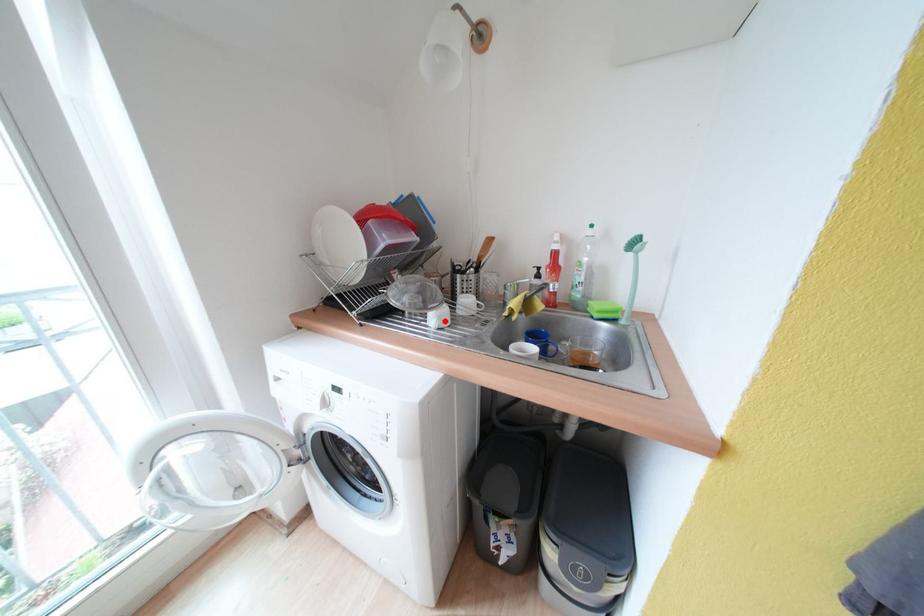
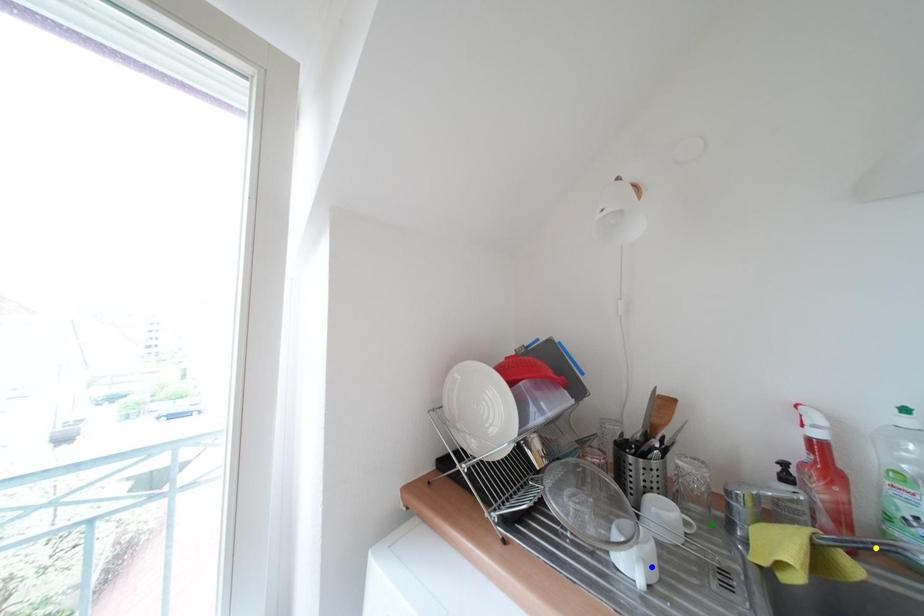
Question: I am providing you with two images of the same scene from different viewpoints. A red point is marked on the first image. You are given multiple points on the second image. Which mark in image 2 goes with the point in image 1?

Choices:
 (A) green point
 (B) blue point
 (C) yellow point

Answer: (B)